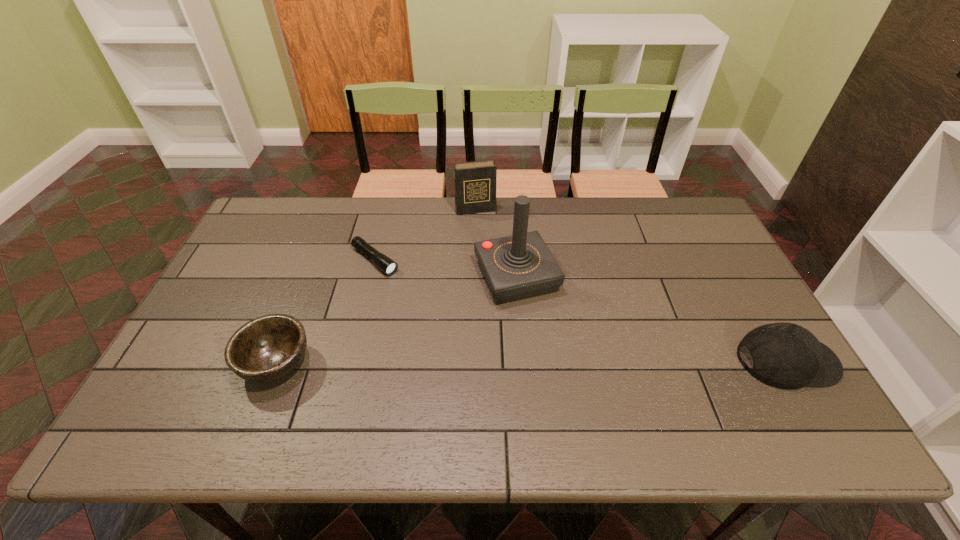
The height and width of the screenshot is (540, 960). I want to click on bowl present at the near edge, so pos(267,348).

This screenshot has width=960, height=540. I want to click on cap that is at the near edge, so click(x=785, y=355).

At what (x,y) coordinates should I click in order to perform the action: click on object at the right edge. Please return your answer as a coordinate pair (x, y). Looking at the image, I should click on (785, 355).

Locate an element on the screen. The image size is (960, 540). object present at the near right corner is located at coordinates (785, 355).

I want to click on free space at the far edge of the desktop, so click(603, 221).

Where is `vacant area at the near edge`? vacant area at the near edge is located at coordinates (535, 374).

Where is `vacant space at the left edge of the desktop`? This screenshot has height=540, width=960. vacant space at the left edge of the desktop is located at coordinates (273, 250).

Identify the location of vacant space at the right edge. tap(695, 295).

This screenshot has height=540, width=960. In the image, there is a desktop. Find the location of `vacant space at the far left corner`. vacant space at the far left corner is located at coordinates tap(299, 216).

Where is `vacant space in between the second shortest object and the joystick`? The height and width of the screenshot is (540, 960). vacant space in between the second shortest object and the joystick is located at coordinates tap(396, 320).